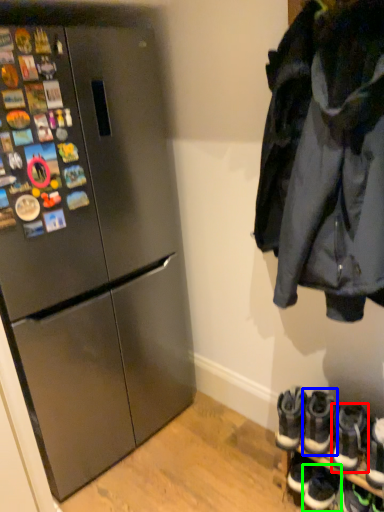
Question: Which object is positioned closest to footwear (highlighted by a red box)? Select from footwear (highlighted by a blue box) and footwear (highlighted by a green box).

Choices:
 (A) footwear
 (B) footwear

Answer: (A)